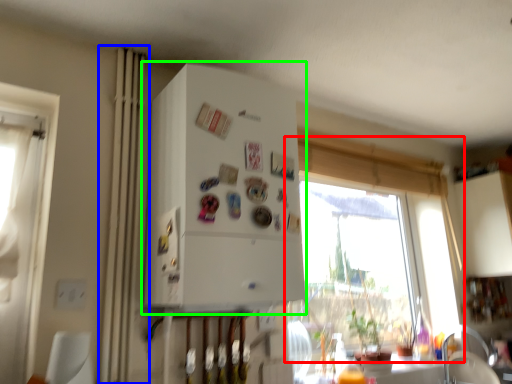
Question: Which object is the closest to the window (highlighted by a red box)? Choose among these: curtain (highlighted by a blue box) or appliance (highlighted by a green box).

Choices:
 (A) curtain
 (B) appliance

Answer: (B)